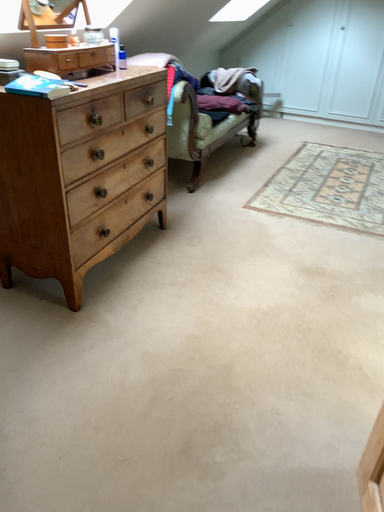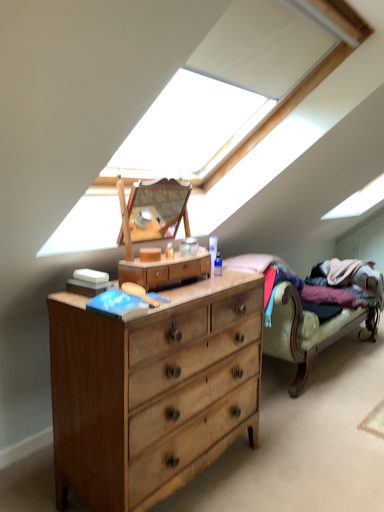
Question: Which way did the camera rotate in the video?

Choices:
 (A) rotated right
 (B) rotated left

Answer: (B)